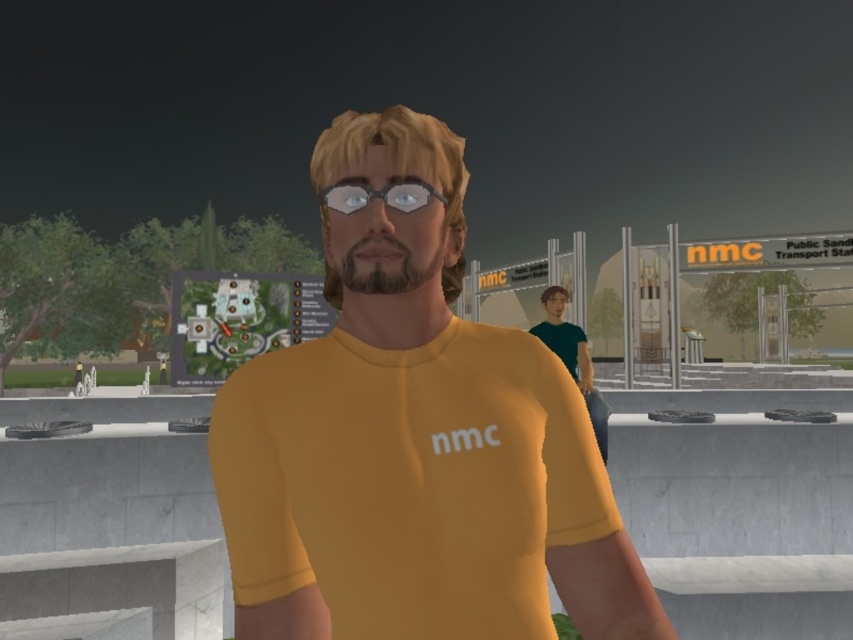
You are a game developer working on a multiplayer game. You need to place two new NPCs in the scene such that they are equidistant from the yellow matte shirt at center. Where should you place them?

To place two NPCs equidistant from the yellow matte shirt at center located at point [415,442], you can position them symmetrically around the shirt. For example, one NPC could be placed at coordinates approximately [415,442] plus a certain distance in one direction, and the other at the same distance in the opposite direction. This ensures both NPCs are equally distant from the central shirt.

You are a character in this virtual environment and need to grab both the yellow matte shirt at center and the transparent plastic goggles at center. Can you reach both items without moving your position?

The distance between the yellow matte shirt at center and the transparent plastic goggles at center is 11.61 inches, so yes, you can reach both items without moving your position if your reach extends at least that far.

You are a character in the game and need to decide whether to wear the transparent plastic goggles at center over the yellow matte shirt at center. Is this possible based on their sizes?

The yellow matte shirt at center is bigger than the transparent plastic goggles at center. Since the shirt is larger, you can wear the transparent plastic goggles at center over the yellow matte shirt at center as the goggles are smaller and designed to fit over clothing.